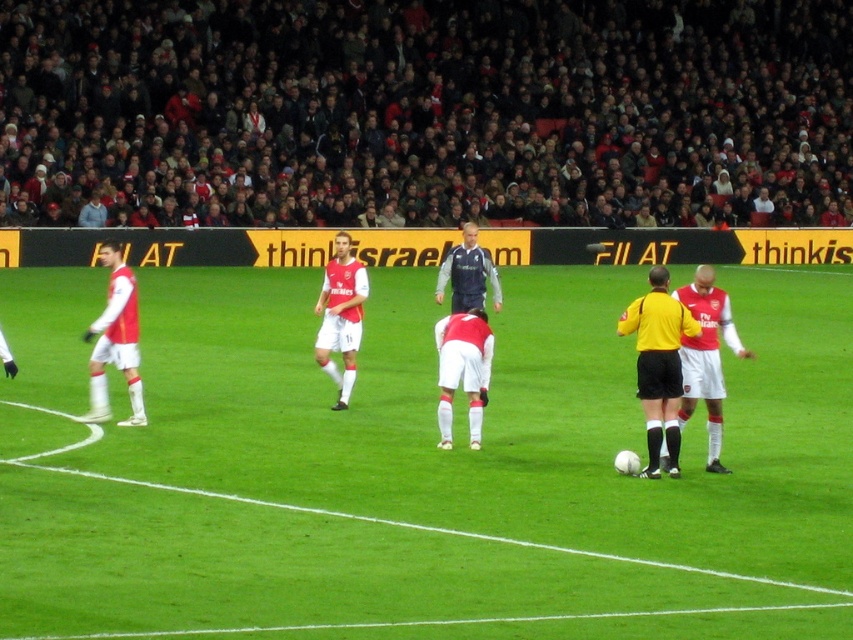
Question: Estimate the real-world distances between objects in this image. Which object is closer to the yellow jersey at center?

Choices:
 (A) matte white jersey at center
 (B) green grass field at center

Answer: (A)

Question: Does red matte jersey at center have a larger size compared to matte white shorts at left?

Choices:
 (A) no
 (B) yes

Answer: (B)

Question: Based on their relative distances, which object is nearer to the white jersey at center?

Choices:
 (A) dark blue jersey at center
 (B) red matte jersey at center

Answer: (A)

Question: Among these points, which one is nearest to the camera?

Choices:
 (A) (106, 392)
 (B) (492, 336)
 (C) (694, 300)

Answer: (C)

Question: Does green grass field at center have a smaller size compared to red matte jersey at center?

Choices:
 (A) yes
 (B) no

Answer: (B)

Question: Can you confirm if matte red jersey at center is thinner than dark blue jersey at center?

Choices:
 (A) yes
 (B) no

Answer: (B)